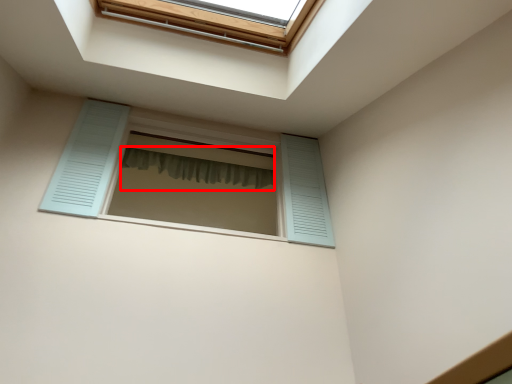
Question: From the image's perspective, where is shower curtain (annotated by the red box) located in relation to window in the image?

Choices:
 (A) above
 (B) below

Answer: (A)